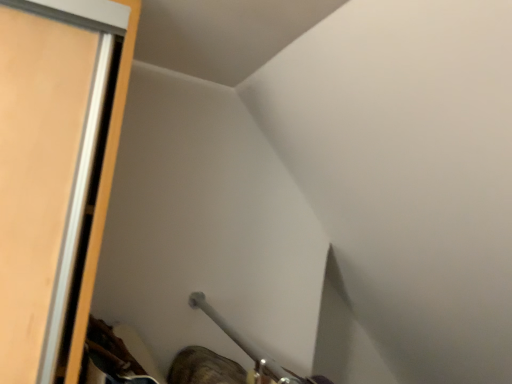
I want to click on metallic silver pole at lower center, so click(250, 349).

Describe the element at coordinates (250, 349) in the screenshot. This screenshot has width=512, height=384. I see `metallic silver pole at lower center` at that location.

Measure the distance between point (x=232, y=329) and camera.

They are 1.04 meters apart.

Locate an element on the screen. metallic silver pole at lower center is located at coordinates (250, 349).